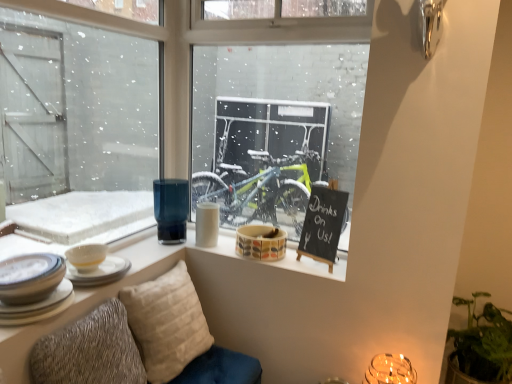
You are a GUI agent. You are given a task and a screenshot of the screen. Output one action in this format:
    pyautogui.click(x=<x>, y=<y>)
    Task: Click on the free space that is in between black chalkboard at upper right and multicolored ceramic mug at center, the 7th tableware in the left-to-right sequence
    This screenshot has width=512, height=384.
    Given the screenshot: What is the action you would take?
    pyautogui.click(x=297, y=259)